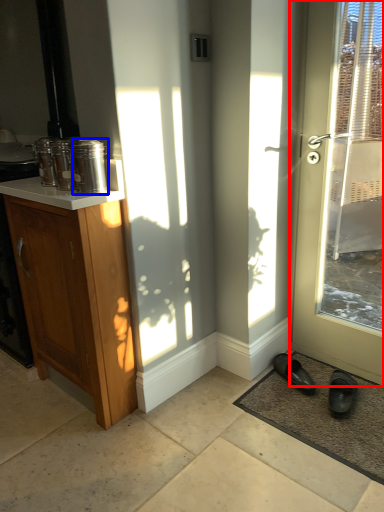
Question: Which of the following is the farthest to the observer, door (highlighted by a red box) or glass jar (highlighted by a blue box)?

Choices:
 (A) door
 (B) glass jar

Answer: (B)